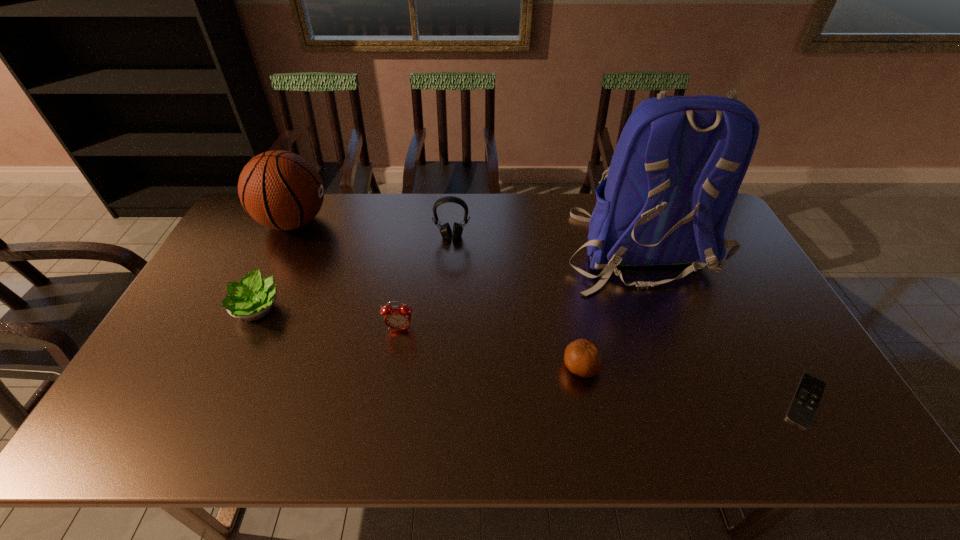
At what (x,y) coordinates should I click in order to perform the action: click on vacant area between the clementine and the sixth shortest object. Please return your answer as a coordinate pair (x, y). Looking at the image, I should click on (438, 295).

Locate an element on the screen. The width and height of the screenshot is (960, 540). empty space between the lettuce and the remote control is located at coordinates (532, 355).

Where is `free space between the remote control and the lettuce`? This screenshot has height=540, width=960. free space between the remote control and the lettuce is located at coordinates (532, 355).

Identify which object is the fourth nearest to the tallest object. Please provide its 2D coordinates. Your answer should be formatted as a tuple, i.e. [(x, y)], where the tuple contains the x and y coordinates of a point satisfying the conditions above.

[(396, 317)]

Locate an element on the screen. The image size is (960, 540). object that is the closest to the remote control is located at coordinates (676, 170).

Locate an element on the screen. This screenshot has width=960, height=540. vacant space that satisfies the following two spatial constraints: 1. on the side where the inflation valve is located; 2. on the left side of the sixth shortest object is located at coordinates (224, 367).

What are the coordinates of `vacant space that satisfies the following two spatial constraints: 1. on the back side of the lettuce; 2. on the side where the inflation valve is located` in the screenshot? It's located at (299, 222).

You are a GUI agent. You are given a task and a screenshot of the screen. Output one action in this format:
    pyautogui.click(x=<x>, y=<y>)
    Task: Click on the vacant region that satisfies the following two spatial constraints: 1. on the front-facing side of the fourth object from right to left; 2. on the left side of the clementine
    
    Given the screenshot: What is the action you would take?
    pyautogui.click(x=443, y=367)

Where is `vacant space that satisfies the following two spatial constraints: 1. on the face of the alarm clock; 2. on the left side of the remote control`? This screenshot has height=540, width=960. vacant space that satisfies the following two spatial constraints: 1. on the face of the alarm clock; 2. on the left side of the remote control is located at coordinates (388, 401).